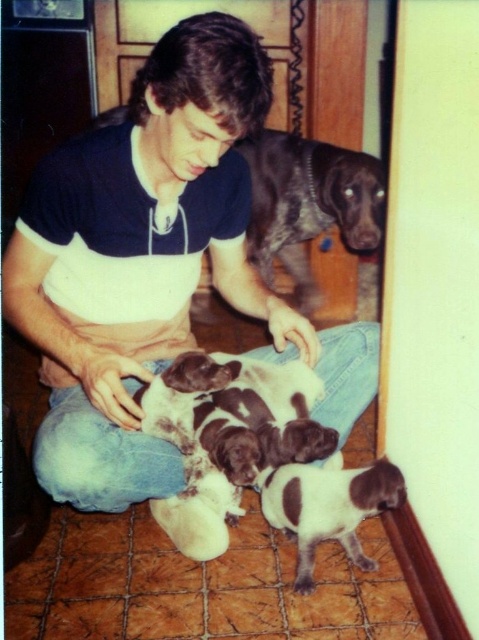
Who is more forward, (316, 292) or (307, 369)?

Positioned in front is point (307, 369).

Does shiny brown dog at upper center have a greater width compared to white and brown fur puppies at center?

Yes, shiny brown dog at upper center is wider than white and brown fur puppies at center.

Where is `shiny brown dog at upper center`? Image resolution: width=479 pixels, height=640 pixels. shiny brown dog at upper center is located at coordinates (308, 204).

Where is `shiny brown dog at upper center`? The width and height of the screenshot is (479, 640). shiny brown dog at upper center is located at coordinates (308, 204).

Between matte black t-shirt at center and shiny brown dog at upper center, which one appears on the right side from the viewer's perspective?

shiny brown dog at upper center

Can you confirm if matte black t-shirt at center is positioned to the right of shiny brown dog at upper center?

In fact, matte black t-shirt at center is to the left of shiny brown dog at upper center.

Locate an element on the screen. matte black t-shirt at center is located at coordinates (152, 266).

Where is `matte black t-shirt at center`? matte black t-shirt at center is located at coordinates (152, 266).

Based on the photo, does matte black t-shirt at center have a lesser width compared to white-furred dog at lower center?

No.

From the picture: Is matte black t-shirt at center above white-furred dog at lower center?

Yes, matte black t-shirt at center is above white-furred dog at lower center.

Is point (79, 298) positioned before point (324, 531)?

Yes, it is.

Where is `matte black t-shirt at center`? This screenshot has width=479, height=640. matte black t-shirt at center is located at coordinates (152, 266).